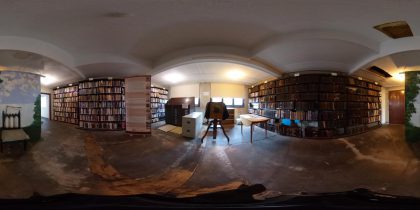
At what (x,y) coordinates should I click in order to perform the action: click on the right wall. Please return your answer as a coordinate pair (x, y). This screenshot has height=210, width=420. Looking at the image, I should click on (386, 101).